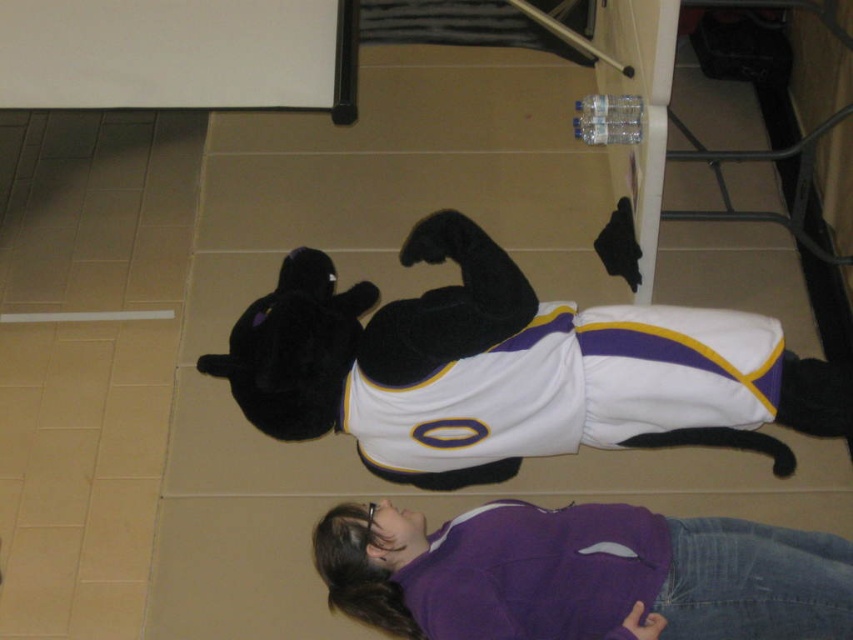
You are a delivery robot in a gymnasium. You need to place a small package that is 12 inches long between the black plush toy at center and the purple fleece jacket at lower center. Is there enough space to fit the package without moving either object?

The black plush toy at center is 14.34 inches from the purple fleece jacket at lower center. Since the package is 12 inches long, there is enough space to fit it between them without moving either object.

You are helping to organize a costume party and need to place the black plush toy at center and the purple fleece jacket at lower center. Which object is covering the other?

The black plush toy at center is positioned over the purple fleece jacket at lower center, so it is covering the jacket.

What is located at the point with coordinates (509, 369) in the image?

The point with coordinates (509, 369) is located on the black plush toy at center.